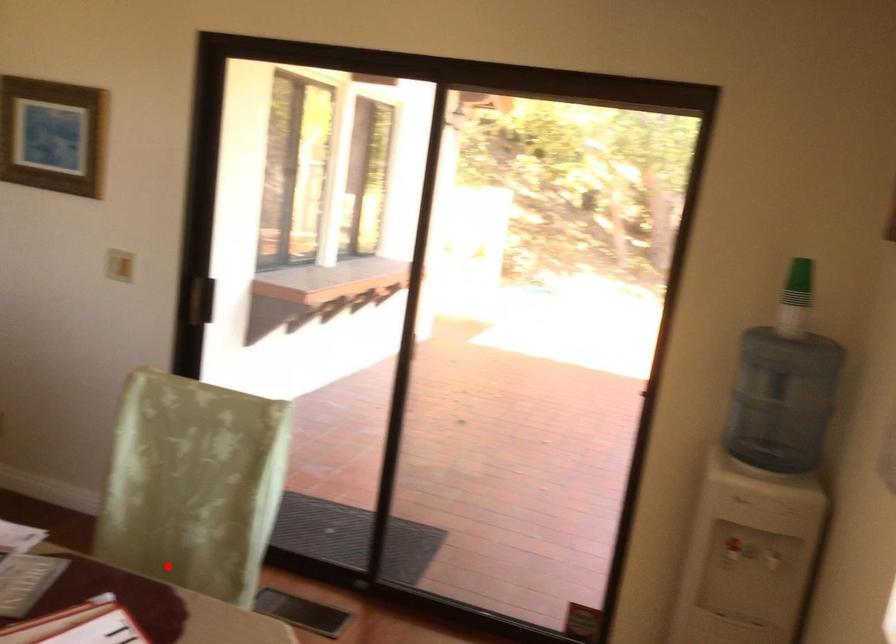
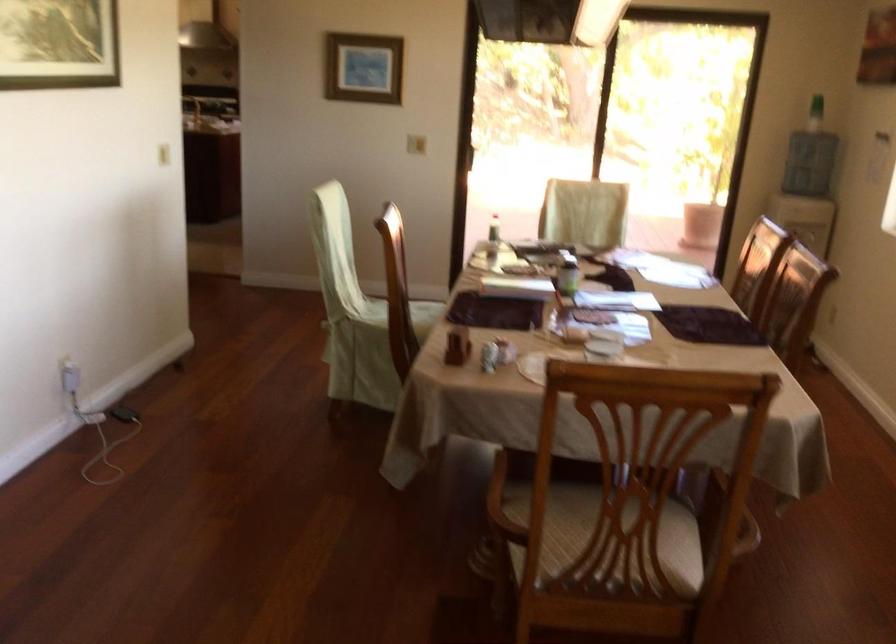
Question: I am providing you with two images of the same scene from different viewpoints. A red point is marked on the first image. Can you still see the location of the red point in image 2?

Choices:
 (A) Yes
 (B) No

Answer: (B)